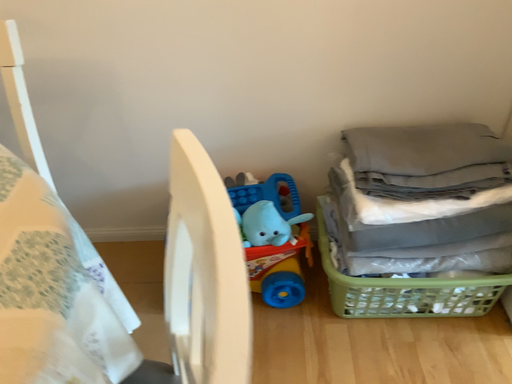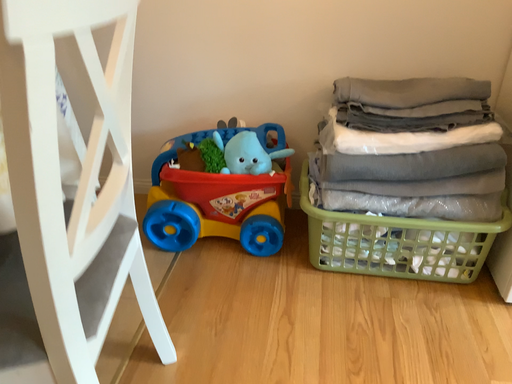
Question: Which way did the camera rotate in the video?

Choices:
 (A) rotated downward
 (B) rotated upward

Answer: (B)